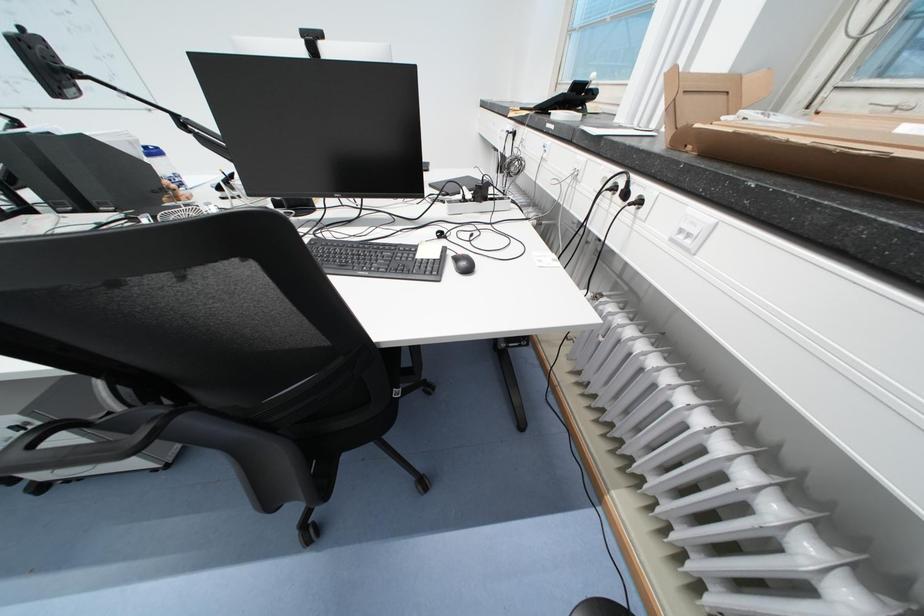
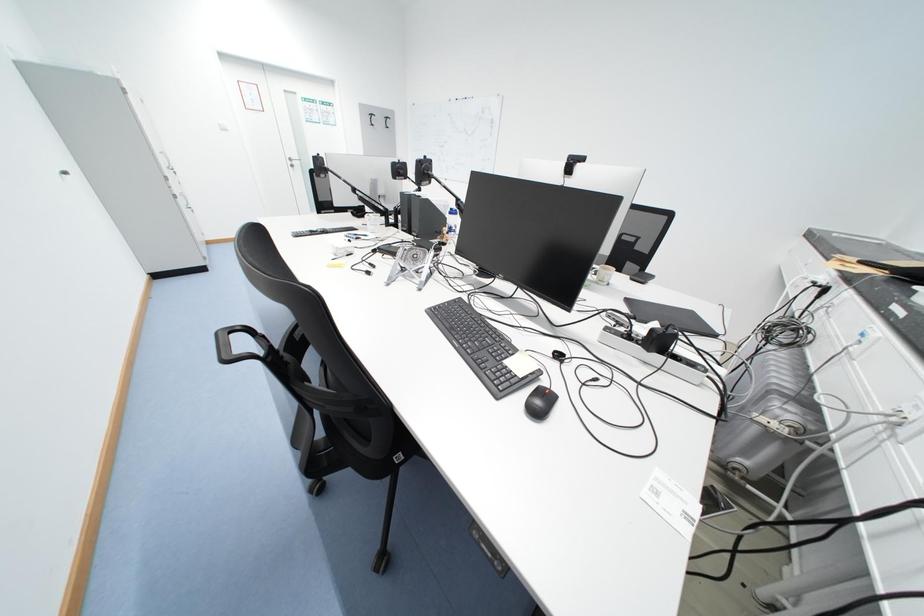
Question: The camera is either moving clockwise (left) or counter-clockwise (right) around the object. The first image is from the beginning of the video and the second image is from the end. Is the camera moving left or right when shooting the video?

Choices:
 (A) Left
 (B) Right

Answer: (B)